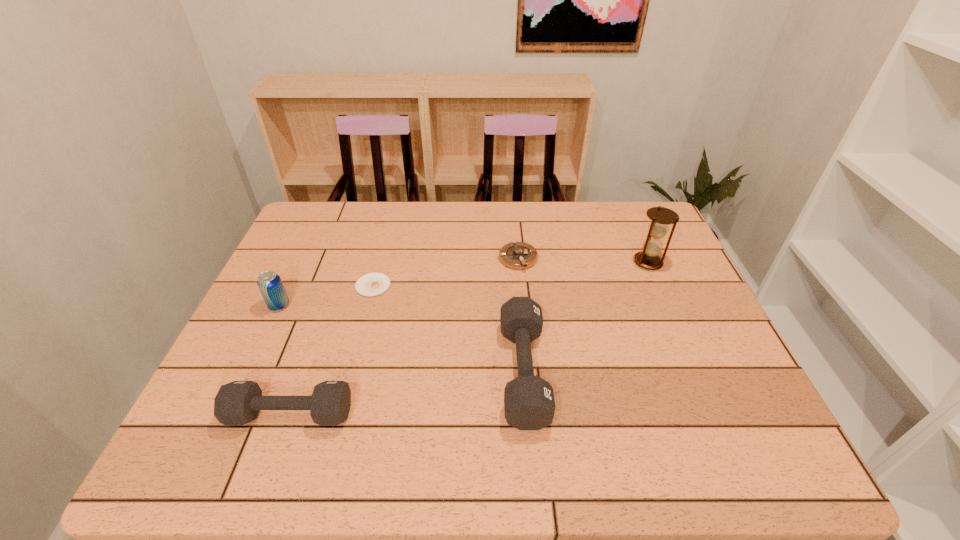
Where is `vacant space at the near edge of the desktop`? The width and height of the screenshot is (960, 540). vacant space at the near edge of the desktop is located at coordinates (462, 415).

The image size is (960, 540). In the image, there is a desktop. Find the location of `vacant space at the left edge`. vacant space at the left edge is located at coordinates (291, 262).

Identify the location of free space at the right edge of the desktop. Image resolution: width=960 pixels, height=540 pixels. (726, 353).

Where is `free space between the tallest object and the egg yolk`? This screenshot has height=540, width=960. free space between the tallest object and the egg yolk is located at coordinates (511, 274).

Where is `empty space that is in between the ashtray and the left dumbbell`? Image resolution: width=960 pixels, height=540 pixels. empty space that is in between the ashtray and the left dumbbell is located at coordinates (404, 336).

This screenshot has height=540, width=960. What are the coordinates of `vacant space in between the second shortest object and the tallest object` in the screenshot? It's located at point(583,260).

You are a GUI agent. You are given a task and a screenshot of the screen. Output one action in this format:
    pyautogui.click(x=<x>, y=<y>)
    Task: Click on the free spot between the rightmost object and the shortest object
    
    Given the screenshot: What is the action you would take?
    pyautogui.click(x=511, y=274)

Find the location of `free spot between the third nearest object and the rightmost object`. free spot between the third nearest object and the rightmost object is located at coordinates (464, 284).

You are a GUI agent. You are given a task and a screenshot of the screen. Output one action in this format:
    pyautogui.click(x=<x>, y=<y>)
    Task: Click on the free space between the shorter dumbbell and the hourglass
    This screenshot has width=960, height=540.
    Given the screenshot: What is the action you would take?
    pyautogui.click(x=469, y=338)

Where is `vacant space that is in between the egg yolk and the ashtray`? vacant space that is in between the egg yolk and the ashtray is located at coordinates (445, 272).